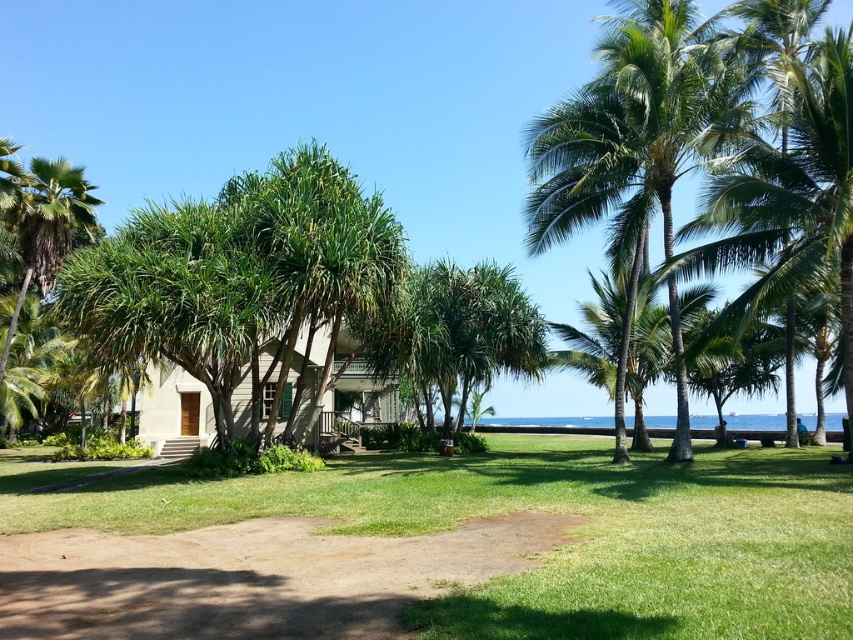
Question: Which point is farther to the camera?

Choices:
 (A) (624, 340)
 (B) (346, 376)
 (C) (306, 568)

Answer: (B)

Question: Estimate the real-world distances between objects in this image. Which object is closer to the green leafy palm tree at center?

Choices:
 (A) green leafy palm tree at upper right
 (B) beige wooden hut at center

Answer: (A)

Question: Can you confirm if beige wooden hut at center is wider than green leafy palm tree at center?

Choices:
 (A) no
 (B) yes

Answer: (B)

Question: Is green leafy palm tree at upper right to the right of beige wooden hut at center from the viewer's perspective?

Choices:
 (A) no
 (B) yes

Answer: (B)

Question: In this image, where is brown dirt path at lower center located relative to beige wooden hut at center?

Choices:
 (A) above
 (B) below

Answer: (B)

Question: Which object appears farthest from the camera in this image?

Choices:
 (A) brown dirt path at lower center
 (B) green leafy palm tree at upper right
 (C) beige wooden hut at center
 (D) green leafy palm tree at center

Answer: (C)